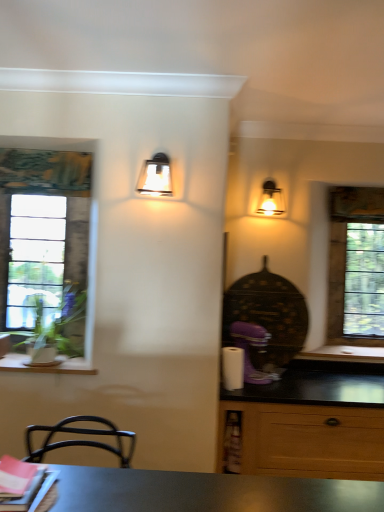
What do you see at coordinates (47, 366) in the screenshot? I see `wooden at left` at bounding box center [47, 366].

Locate an element on the screen. Image resolution: width=384 pixels, height=512 pixels. matte glass sconce at upper right, which appears as the 2th lamp when viewed from the left is located at coordinates (271, 200).

Measure the distance between metallic glass sconce at upper center, which appears as the first lamp when viewed from the front, and camera.

A distance of 7.21 feet exists between metallic glass sconce at upper center, which appears as the first lamp when viewed from the front, and camera.

I want to click on clear glass window at left, the 1th window when ordered from front to back, so click(x=89, y=292).

From a real-world perspective, which object stands above the other?

metallic glass sconce at upper center, acting as the second lamp starting from the right, is physically above.

Does wooden at left turn towards metallic glass sconce at upper center, which appears as the first lamp when viewed from the front?

No, wooden at left does not turn towards metallic glass sconce at upper center, which appears as the first lamp when viewed from the front.

Is wooden at left next to metallic glass sconce at upper center, which appears as the first lamp when viewed from the front?

No, wooden at left is not making contact with metallic glass sconce at upper center, which appears as the first lamp when viewed from the front.

Is wooden at left located outside metallic glass sconce at upper center, which appears as the first lamp when viewed from the front?

Yes, wooden at left is located beyond the bounds of metallic glass sconce at upper center, which appears as the first lamp when viewed from the front.

Is clear glass window at right, which ranks as the 1th window in back-to-front order, to the left or to the right of wooden at left in the image?

From the image, it's evident that clear glass window at right, which ranks as the 1th window in back-to-front order, is to the right of wooden at left.

Can you see clear glass window at right, which is counted as the 2th window, starting from the left, touching wooden at left?

No, clear glass window at right, which is counted as the 2th window, starting from the left, is not touching wooden at left.

From a real-world perspective, which object rests below the other?

wooden at left, from a real-world perspective.

Consider the image. Which of these two, clear glass window at right, which ranks as the 1th window in right-to-left order, or wooden at left, is smaller?

Smaller between the two is wooden at left.

Which is more to the left, clear glass window at right, which ranks as the 1th window in right-to-left order, or clear glass window at left, the 2th window when ordered from right to left?

From the viewer's perspective, clear glass window at left, the 2th window when ordered from right to left, appears more on the left side.

Does clear glass window at right, which ranks as the 1th window in back-to-front order, turn towards clear glass window at left, the 2th window positioned from the back?

No, clear glass window at right, which ranks as the 1th window in back-to-front order, is not facing towards clear glass window at left, the 2th window positioned from the back.

What's the angular difference between clear glass window at right, which is counted as the 2th window, starting from the left, and clear glass window at left, marked as the first window in a left-to-right arrangement,'s facing directions?

They differ by 0.208 degrees in their facing directions.

In the scene shown: Which of these two, clear glass window at right, positioned as the second window in front-to-back order, or clear glass window at left, the 2th window positioned from the back, is thinner?

clear glass window at right, positioned as the second window in front-to-back order.

Which is in front, point (156, 178) or point (7, 370)?

Positioned in front is point (156, 178).

From a real-world perspective, between metallic glass sconce at upper center, which is the second lamp in back-to-front order, and wooden at left, who is vertically lower?

In real-world perspective, wooden at left is lower.

What's the angular difference between metallic glass sconce at upper center, acting as the second lamp starting from the right, and wooden at left's facing directions?

The angle between the facing direction of metallic glass sconce at upper center, acting as the second lamp starting from the right, and the facing direction of wooden at left is 0.876 degrees.

Looking at this image, from their relative heights in the image, would you say metallic glass sconce at upper center, which is the second lamp in back-to-front order, is taller or shorter than wooden at left?

Considering their sizes, metallic glass sconce at upper center, which is the second lamp in back-to-front order, has more height than wooden at left.

Identify the location of window on the right side of metallic glass sconce at upper center, acting as the second lamp starting from the right. The image size is (384, 512). (345, 251).

Who is taller, clear glass window at right, which ranks as the 1th window in right-to-left order, or metallic glass sconce at upper center, which appears as the first lamp when viewed from the front?

Standing taller between the two is clear glass window at right, which ranks as the 1th window in right-to-left order.

Considering the relative positions of clear glass window at right, which ranks as the 1th window in right-to-left order, and metallic glass sconce at upper center, which is the second lamp in back-to-front order, in the image provided, is clear glass window at right, which ranks as the 1th window in right-to-left order, in front of metallic glass sconce at upper center, which is the second lamp in back-to-front order,?

That is False.

Is metallic glass sconce at upper center, which is the second lamp in back-to-front order, not within clear glass window at right, positioned as the second window in front-to-back order?

Yes, metallic glass sconce at upper center, which is the second lamp in back-to-front order, is located beyond the bounds of clear glass window at right, positioned as the second window in front-to-back order.

Can you see metallic glass sconce at upper center, acting as the second lamp starting from the right, touching clear glass window at right, which is counted as the 2th window, starting from the left?

They are not placed beside each other.

Is metallic glass sconce at upper center, acting as the second lamp starting from the right, taller than clear glass window at right, which is counted as the 2th window, starting from the left?

No, metallic glass sconce at upper center, acting as the second lamp starting from the right, is not taller than clear glass window at right, which is counted as the 2th window, starting from the left.

Between metallic glass sconce at upper center, acting as the second lamp starting from the right, and clear glass window at right, which ranks as the 1th window in right-to-left order, which one has smaller width?

A: With smaller width is clear glass window at right, which ranks as the 1th window in right-to-left order.

Is metallic glass sconce at upper center, acting as the second lamp starting from the right, to the left of clear glass window at left, the 2th window when ordered from right to left, from the viewer's perspective?

No.

In the scene shown: Is metallic glass sconce at upper center, acting as the second lamp starting from the right, spatially inside clear glass window at left, the 1th window when ordered from front to back, or outside of it?

The correct answer is: outside.

Is metallic glass sconce at upper center, which is the second lamp in back-to-front order, positioned before clear glass window at left, the 2th window when ordered from right to left?

Yes, metallic glass sconce at upper center, which is the second lamp in back-to-front order, is closer to the viewer.

Can you see metallic glass sconce at upper center, which appears as the first lamp when viewed from the front, touching clear glass window at left, the 2th window when ordered from right to left?

No, metallic glass sconce at upper center, which appears as the first lamp when viewed from the front, is not making contact with clear glass window at left, the 2th window when ordered from right to left.

At what (x,y) coordinates should I click in order to perform the action: click on window sill located on the left of metallic glass sconce at upper center, which appears as the first lamp when viewed from the front. Please return your answer as a coordinate pair (x, y). This screenshot has width=384, height=512. Looking at the image, I should click on (47, 366).

Image resolution: width=384 pixels, height=512 pixels. In order to click on window sill located in front of the clear glass window at right, positioned as the second window in front-to-back order in this screenshot , I will do `click(47, 366)`.

Based on their spatial positions, is wooden at left or metallic glass sconce at upper center, which is the second lamp in back-to-front order, closer to clear glass window at right, which is counted as the 2th window, starting from the left?

metallic glass sconce at upper center, which is the second lamp in back-to-front order, lies closer to clear glass window at right, which is counted as the 2th window, starting from the left, than the other object.

Consider the image. Which object lies nearer to the anchor point clear glass window at left, marked as the first window in a left-to-right arrangement, matte glass sconce at upper right, which appears as the 2th lamp when viewed from the left, or wooden at left?

wooden at left is positioned closer to the anchor clear glass window at left, marked as the first window in a left-to-right arrangement.

Looking at the image, which one is located closer to clear glass window at right, positioned as the second window in front-to-back order, clear glass window at left, the 2th window positioned from the back, or matte glass sconce at upper right, the first lamp viewed from the right?

The object closer to clear glass window at right, positioned as the second window in front-to-back order, is matte glass sconce at upper right, the first lamp viewed from the right.

When comparing their distances from metallic glass sconce at upper center, which appears as the first lamp when viewed from the front, does wooden at left or clear glass window at left, marked as the first window in a left-to-right arrangement, seem closer?

Among the two, clear glass window at left, marked as the first window in a left-to-right arrangement, is located nearer to metallic glass sconce at upper center, which appears as the first lamp when viewed from the front.

From the image, which object appears to be nearer to wooden at left, clear glass window at right, which ranks as the 1th window in back-to-front order, or clear glass window at left, the 2th window positioned from the back?

clear glass window at left, the 2th window positioned from the back, lies closer to wooden at left than the other object.

When comparing their distances from metallic glass sconce at upper center, marked as the first lamp in a left-to-right arrangement, does clear glass window at right, which ranks as the 1th window in right-to-left order, or matte glass sconce at upper right, the second lamp in the front-to-back sequence, seem further?

Among the two, clear glass window at right, which ranks as the 1th window in right-to-left order, is located further to metallic glass sconce at upper center, marked as the first lamp in a left-to-right arrangement.

Which object lies nearer to the anchor point matte glass sconce at upper right, the first lamp viewed from the back, clear glass window at right, which ranks as the 1th window in right-to-left order, or clear glass window at left, the 2th window positioned from the back?

The object closer to matte glass sconce at upper right, the first lamp viewed from the back, is clear glass window at right, which ranks as the 1th window in right-to-left order.

Estimate the real-world distances between objects in this image. Which object is further from wooden at left, matte glass sconce at upper right, the first lamp viewed from the back, or clear glass window at left, marked as the first window in a left-to-right arrangement?

Based on the image, matte glass sconce at upper right, the first lamp viewed from the back, appears to be further to wooden at left.

I want to click on lamp between metallic glass sconce at upper center, which is the second lamp in back-to-front order, and clear glass window at right, which ranks as the 1th window in back-to-front order, so click(271, 200).

Locate an element on the screen. Image resolution: width=384 pixels, height=512 pixels. window sill between clear glass window at left, the 2th window positioned from the back, and clear glass window at right, which is counted as the 2th window, starting from the left is located at coordinates (47, 366).

Identify the location of lamp between wooden at left and matte glass sconce at upper right, the first lamp viewed from the right. (155, 176).

Identify the location of lamp between clear glass window at left, the 2th window positioned from the back, and matte glass sconce at upper right, the first lamp viewed from the right. This screenshot has height=512, width=384. (155, 176).